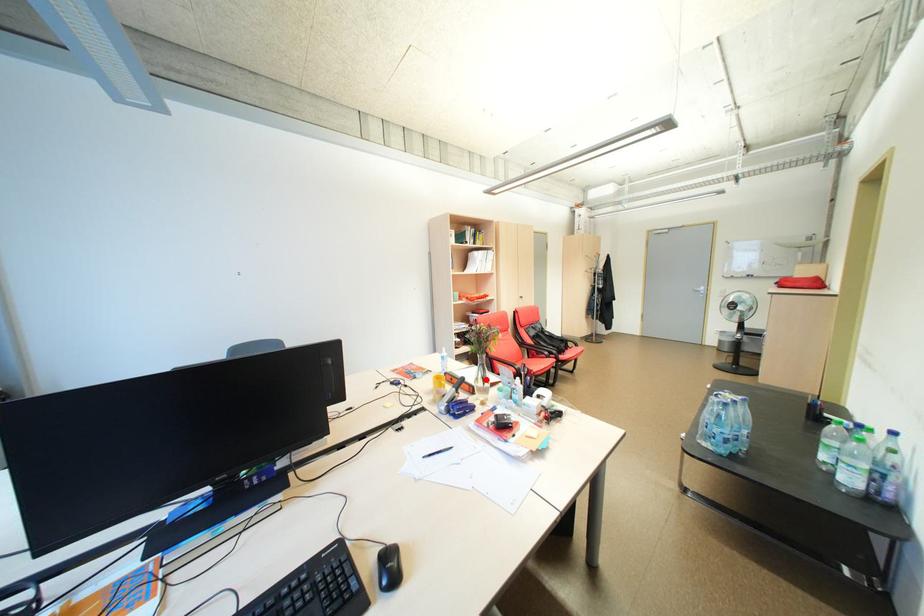
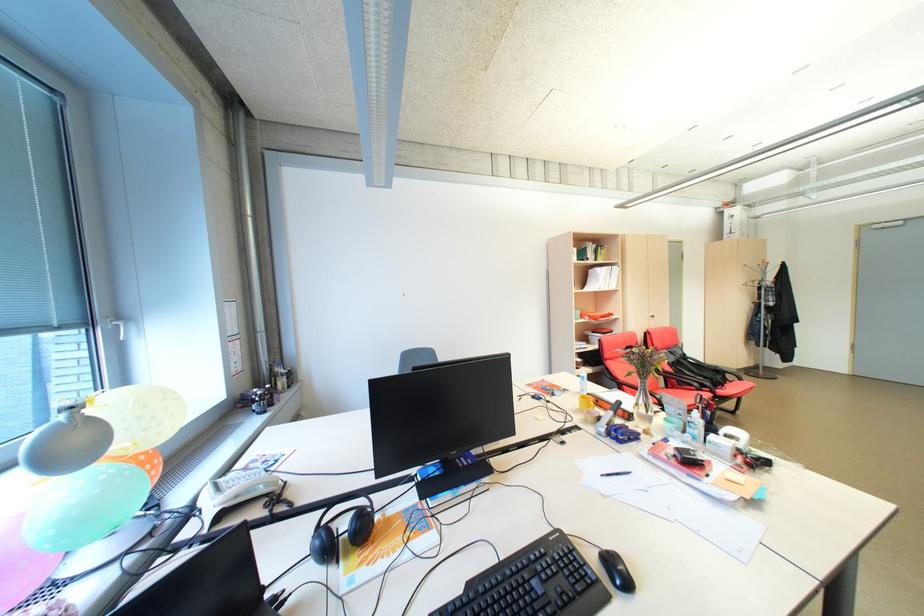
Find the pixel in the second image that matches the highlighted location in the first image.

(646, 406)